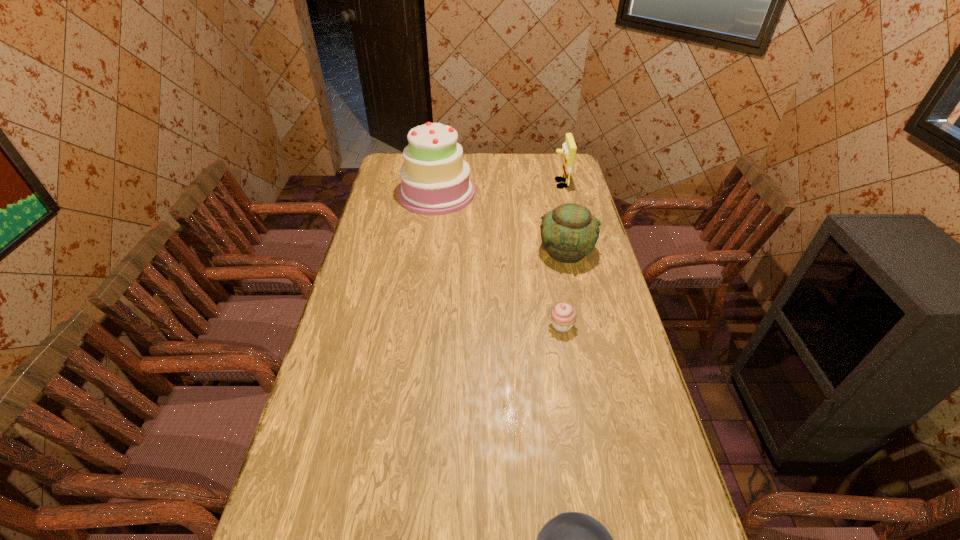
What are the coordinates of `vacant area situated on the face of the sponge` in the screenshot? It's located at (498, 184).

In order to click on free region located on the left of the third nearest object in this screenshot , I will do `click(434, 251)`.

Where is `blank space located on the left of the cupcake`? blank space located on the left of the cupcake is located at coordinates (453, 326).

Where is `cake that is at the far edge`? The image size is (960, 540). cake that is at the far edge is located at coordinates (435, 179).

In order to click on sponge located in the far edge section of the desktop in this screenshot , I will do `click(569, 148)`.

Locate an element on the screen. object located at the left edge is located at coordinates (435, 179).

Find the location of a particular element. sponge at the right edge is located at coordinates [x=569, y=148].

Find the location of a particular element. pottery located in the right edge section of the desktop is located at coordinates (569, 232).

Locate an element on the screen. This screenshot has width=960, height=540. cupcake that is at the right edge is located at coordinates (563, 316).

This screenshot has height=540, width=960. I want to click on object that is at the far left corner, so click(x=435, y=179).